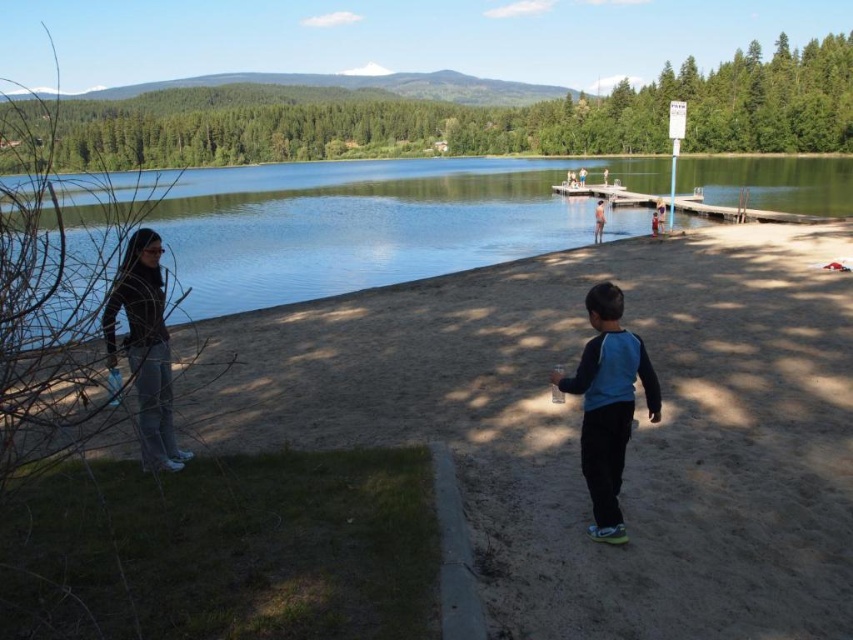
You are standing on the brown sandy beach at lower center and want to reach the clear water at center. Which direction should you walk to get to the water?

You should walk forward because the brown sandy beach at lower center is in front of the clear water at center, so moving forward from the beach will lead you directly to the water.